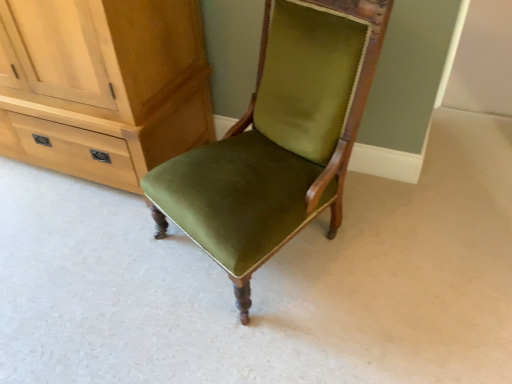
Question: Can you confirm if velvet green chair at center is wider than matte wood cabinet at left?

Choices:
 (A) yes
 (B) no

Answer: (A)

Question: Can you confirm if velvet green chair at center is smaller than matte wood cabinet at left?

Choices:
 (A) yes
 (B) no

Answer: (A)

Question: Can we say velvet green chair at center lies outside matte wood cabinet at left?

Choices:
 (A) yes
 (B) no

Answer: (A)

Question: Does velvet green chair at center turn towards matte wood cabinet at left?

Choices:
 (A) yes
 (B) no

Answer: (B)

Question: From a real-world perspective, is velvet green chair at center under matte wood cabinet at left?

Choices:
 (A) yes
 (B) no

Answer: (B)

Question: Is velvet green chair at center to the right of matte wood cabinet at left from the viewer's perspective?

Choices:
 (A) no
 (B) yes

Answer: (B)

Question: From a real-world perspective, is matte wood cabinet at left on top of velvet green chair at center?

Choices:
 (A) no
 (B) yes

Answer: (A)

Question: Considering the relative sizes of matte wood cabinet at left and velvet green chair at center in the image provided, is matte wood cabinet at left wider than velvet green chair at center?

Choices:
 (A) yes
 (B) no

Answer: (B)

Question: Does matte wood cabinet at left lie behind velvet green chair at center?

Choices:
 (A) yes
 (B) no

Answer: (A)

Question: Does matte wood cabinet at left lie in front of velvet green chair at center?

Choices:
 (A) no
 (B) yes

Answer: (A)

Question: Is matte wood cabinet at left positioned far away from velvet green chair at center?

Choices:
 (A) yes
 (B) no

Answer: (B)

Question: From the image's perspective, is matte wood cabinet at left under velvet green chair at center?

Choices:
 (A) no
 (B) yes

Answer: (A)

Question: Is matte wood cabinet at left in front of or behind velvet green chair at center in the image?

Choices:
 (A) front
 (B) behind

Answer: (B)